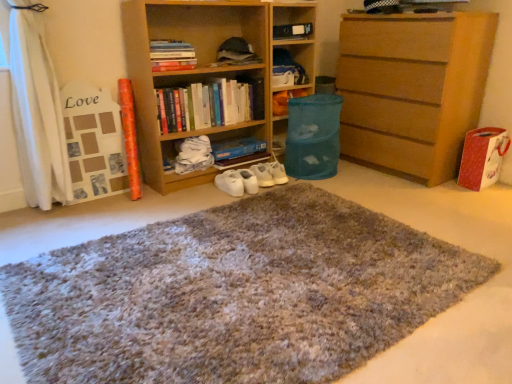
Locate an element on the screen. free space between light brown wooden chest of drawers at right and shaggy carpet at center is located at coordinates (371, 205).